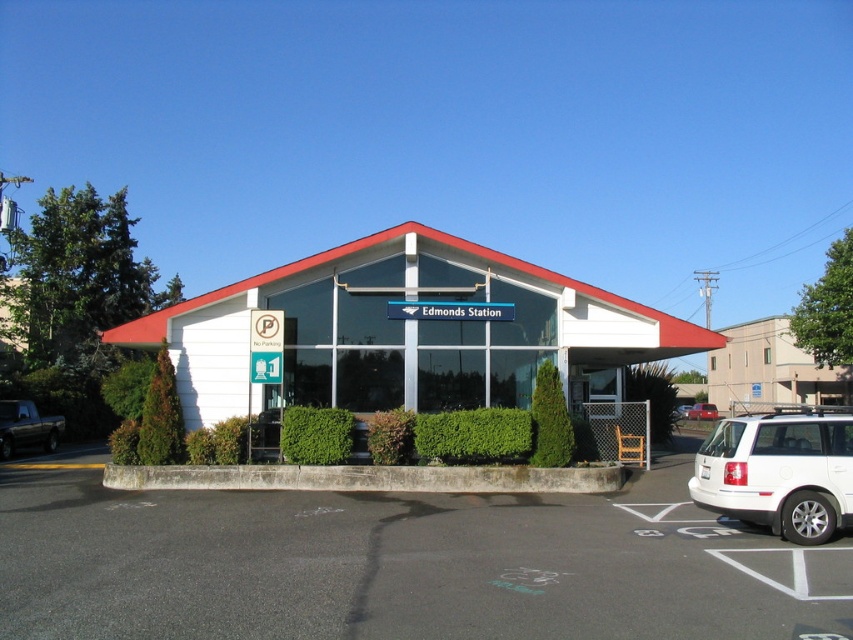
Question: Does gray asphalt parking lot at center appear on the left side of matte black truck at left?

Choices:
 (A) yes
 (B) no

Answer: (B)

Question: Observing the image, what is the correct spatial positioning of gray asphalt parking lot at center in reference to matte black truck at left?

Choices:
 (A) left
 (B) right

Answer: (B)

Question: Which is farther from the matte black truck at left?

Choices:
 (A) metallic silver suv at center
 (B) gray asphalt parking lot at center
 (C) white matte suv at lower right

Answer: (A)

Question: Does gray asphalt parking lot at center have a smaller size compared to white matte suv at lower right?

Choices:
 (A) no
 (B) yes

Answer: (A)

Question: Considering the real-world distances, which object is farthest from the matte black truck at left?

Choices:
 (A) gray asphalt parking lot at center
 (B) white matte suv at lower right

Answer: (B)

Question: Which point appears closest to the camera in this image?

Choices:
 (A) (701, 417)
 (B) (680, 417)

Answer: (B)